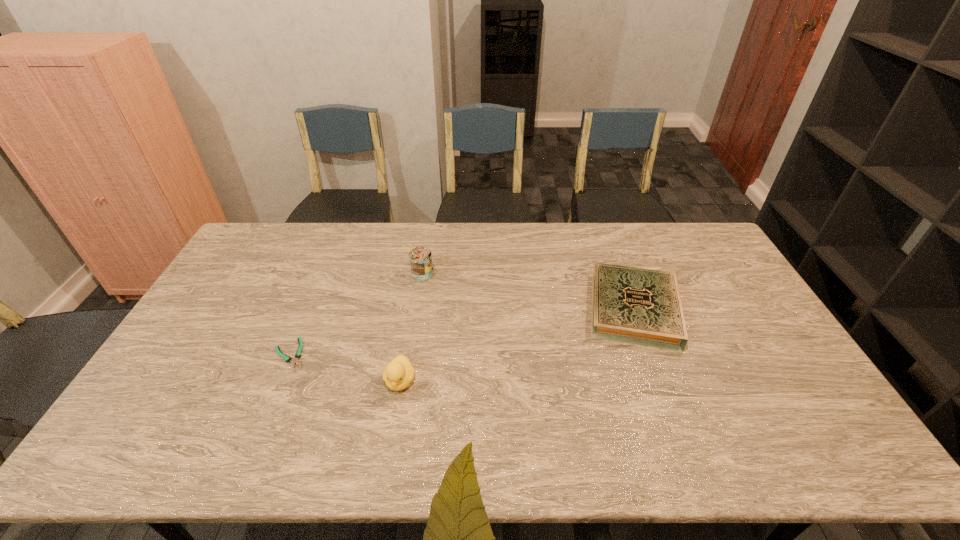
At what (x,y) coordinates should I click in order to perform the action: click on vacant space that's between the rightmost object and the leftmost object. Please return your answer as a coordinate pair (x, y). Looking at the image, I should click on (462, 332).

Where is `free point between the rightmost object and the duck`? The width and height of the screenshot is (960, 540). free point between the rightmost object and the duck is located at coordinates (516, 345).

Identify the location of empty space that is in between the duck and the hardback book. This screenshot has width=960, height=540. (516, 345).

Where is `vacant area between the tallest object and the third shortest object`? The height and width of the screenshot is (540, 960). vacant area between the tallest object and the third shortest object is located at coordinates (411, 328).

Find the location of a particular element. The height and width of the screenshot is (540, 960). vacant region between the third tallest object and the leftmost object is located at coordinates coord(462,332).

Find the location of a particular element. free spot between the leftmost object and the third shortest object is located at coordinates (345, 368).

You are a GUI agent. You are given a task and a screenshot of the screen. Output one action in this format:
    pyautogui.click(x=<x>, y=<y>)
    Task: Click on the object that is the third closest one to the rightmost object
    This screenshot has width=960, height=540.
    Given the screenshot: What is the action you would take?
    pyautogui.click(x=298, y=354)

Where is `the second closest object relative to the tallest object`? Image resolution: width=960 pixels, height=540 pixels. the second closest object relative to the tallest object is located at coordinates (398, 374).

The width and height of the screenshot is (960, 540). What are the coordinates of `free space that satisfies the following two spatial constraints: 1. on the back side of the leftmost object; 2. on the left side of the rightmost object` in the screenshot? It's located at (308, 309).

Where is `vacant space that satisfies the following two spatial constraints: 1. on the back side of the pliers; 2. on the left side of the hardback book`? This screenshot has height=540, width=960. vacant space that satisfies the following two spatial constraints: 1. on the back side of the pliers; 2. on the left side of the hardback book is located at coordinates (308, 309).